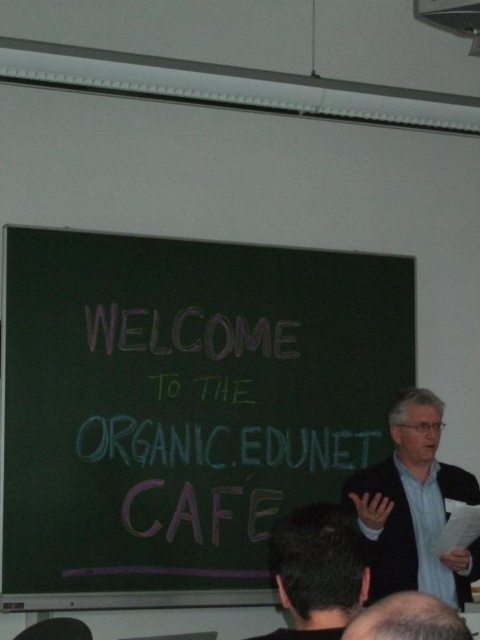
Can you confirm if light gray suit at right is positioned below dark gray hair at upper center?

Correct, light gray suit at right is located below dark gray hair at upper center.

Can you confirm if light gray suit at right is positioned above dark gray hair at upper center?

Incorrect, light gray suit at right is not positioned above dark gray hair at upper center.

Locate an element on the screen. light gray suit at right is located at coordinates point(414,506).

Between point (135, 497) and point (420, 612), which one is positioned in front?

Positioned in front is point (420, 612).

Does chalkboard at center come behind dark gray hair at lower center?

Yes, chalkboard at center is behind dark gray hair at lower center.

Which is behind, point (222, 554) or point (440, 634)?

The point (222, 554) is behind.

The width and height of the screenshot is (480, 640). In order to click on chalkboard at center in this screenshot , I will do `click(182, 408)`.

Which is in front, point (136, 444) or point (333, 556)?

Point (333, 556)

Does chalkboard at center appear under dark gray hair at upper center?

Incorrect, chalkboard at center is not positioned below dark gray hair at upper center.

Does point (92, 285) come closer to viewer compared to point (323, 611)?

No, (92, 285) is behind (323, 611).

Locate an element on the screen. This screenshot has height=640, width=480. chalkboard at center is located at coordinates (182, 408).